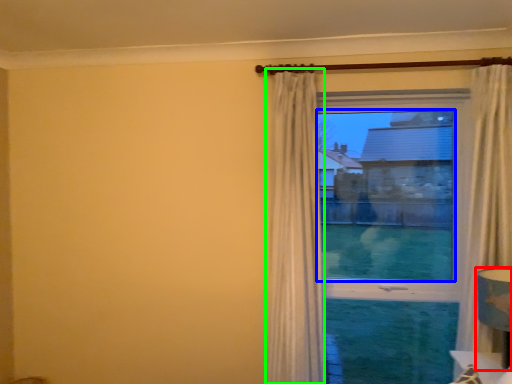
Question: Based on their relative distances, which object is nearer to table lamp (highlighted by a red box)? Choose from window screen (highlighted by a blue box) and curtain (highlighted by a green box).

Choices:
 (A) window screen
 (B) curtain

Answer: (A)